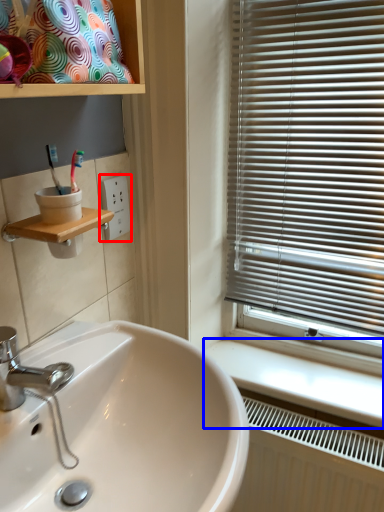
Question: Which of the following is the farthest to the observer, electric outlet (highlighted by a red box) or counter top (highlighted by a blue box)?

Choices:
 (A) electric outlet
 (B) counter top

Answer: (A)